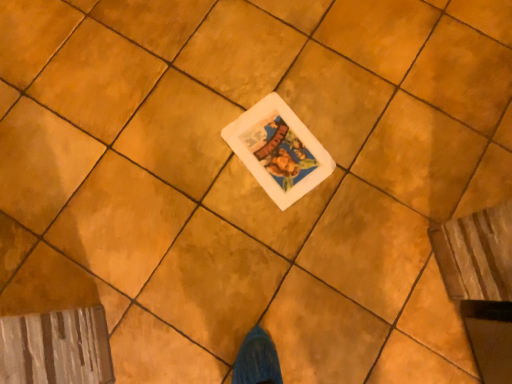
Identify the location of free location in front of white matte comic book at center. The image size is (512, 384). (266, 231).